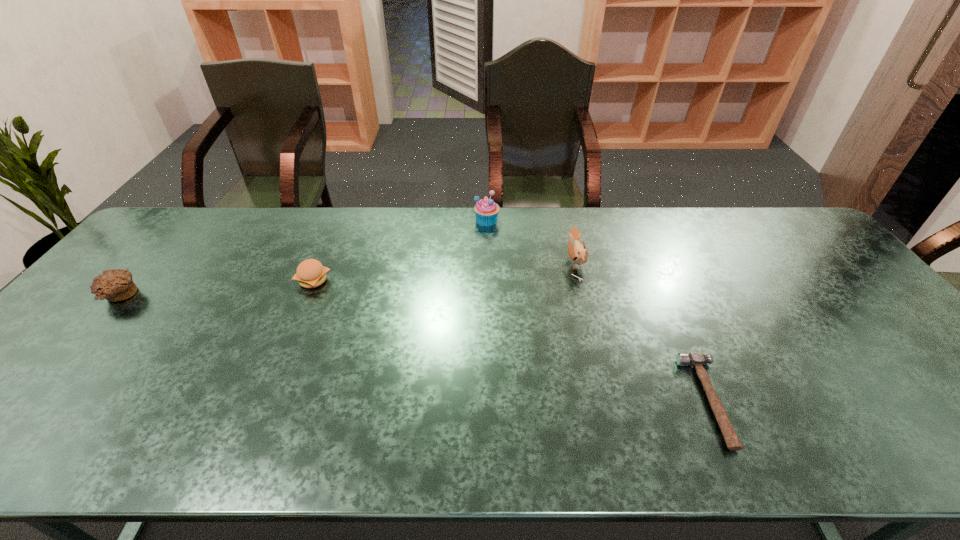
Where is `object located in the left edge section of the desktop`? object located in the left edge section of the desktop is located at coordinates (114, 285).

Locate an element on the screen. free spot at the far edge of the desktop is located at coordinates (567, 211).

Locate an element on the screen. This screenshot has height=540, width=960. free spot at the near edge of the desktop is located at coordinates (331, 427).

Locate an element on the screen. Image resolution: width=960 pixels, height=540 pixels. vacant space at the right edge is located at coordinates (867, 330).

Image resolution: width=960 pixels, height=540 pixels. Find the location of `free point at the far right corner`. free point at the far right corner is located at coordinates (810, 236).

Locate an element on the screen. free space between the hamburger and the bird is located at coordinates (444, 272).

The image size is (960, 540). I want to click on unoccupied area between the hamburger and the leftmost object, so click(216, 288).

Find the location of a particular element. This screenshot has width=960, height=540. blank region between the second object from left to right and the rightmost object is located at coordinates (512, 341).

Where is `vacant space that's between the taller muffin and the left muffin`? The height and width of the screenshot is (540, 960). vacant space that's between the taller muffin and the left muffin is located at coordinates (303, 258).

The height and width of the screenshot is (540, 960). I want to click on free area in between the bird and the leftmost object, so click(348, 279).